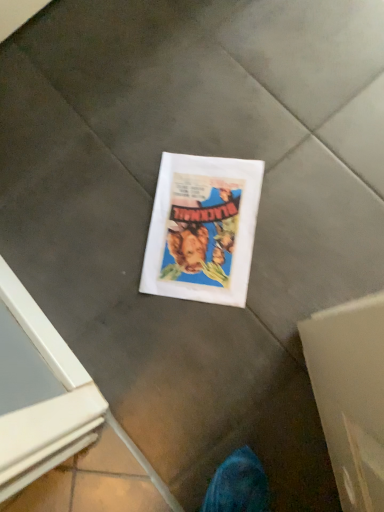
Where is `white paper at center`? Image resolution: width=384 pixels, height=512 pixels. white paper at center is located at coordinates (202, 229).

This screenshot has height=512, width=384. What do you see at coordinates (202, 229) in the screenshot?
I see `white paper at center` at bounding box center [202, 229].

Locate an element on the screen. This screenshot has height=512, width=384. white paper at center is located at coordinates (202, 229).